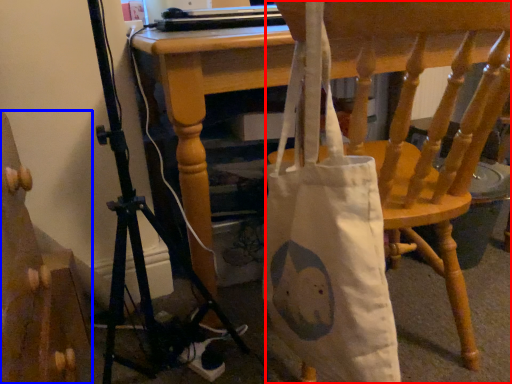
Question: Among these objects, which one is nearest to the camera, chair (highlighted by a red box) or furniture (highlighted by a blue box)?

Choices:
 (A) chair
 (B) furniture

Answer: (B)